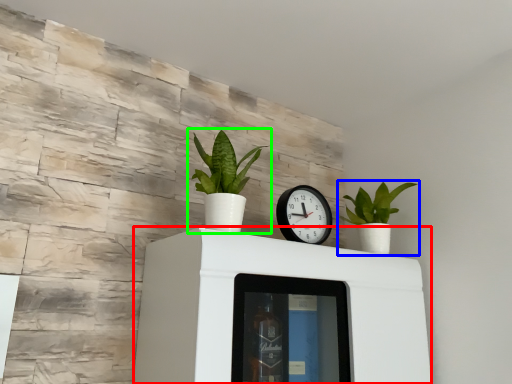
Question: Based on their relative distances, which object is farther from furniture (highlighted by a red box)? Choose from houseplant (highlighted by a blue box) and houseplant (highlighted by a green box).

Choices:
 (A) houseplant
 (B) houseplant

Answer: (A)